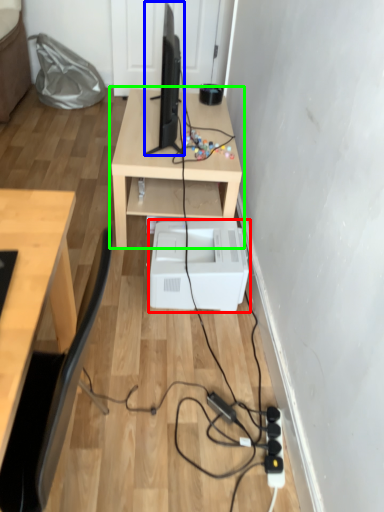
Question: Which object is positioned farthest from printer (highlighted by a red box)? Select from desktop computer (highlighted by a blue box) and table (highlighted by a green box).

Choices:
 (A) desktop computer
 (B) table

Answer: (A)